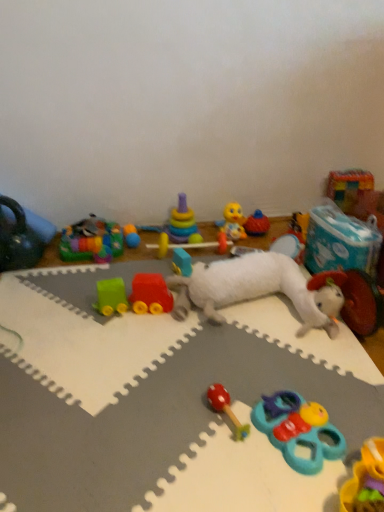
Identify the location of blank area to the left of rubber block at center, which is the fifth toy in left-to-right order. (147, 268).